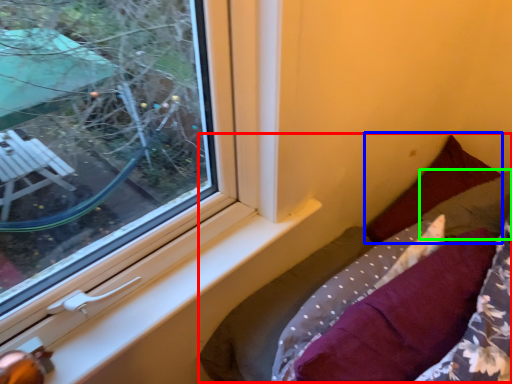
Question: Based on their relative distances, which object is nearer to bed (highlighted by a red box)? Choose from pillow (highlighted by a blue box) and pillow (highlighted by a green box).

Choices:
 (A) pillow
 (B) pillow

Answer: (A)